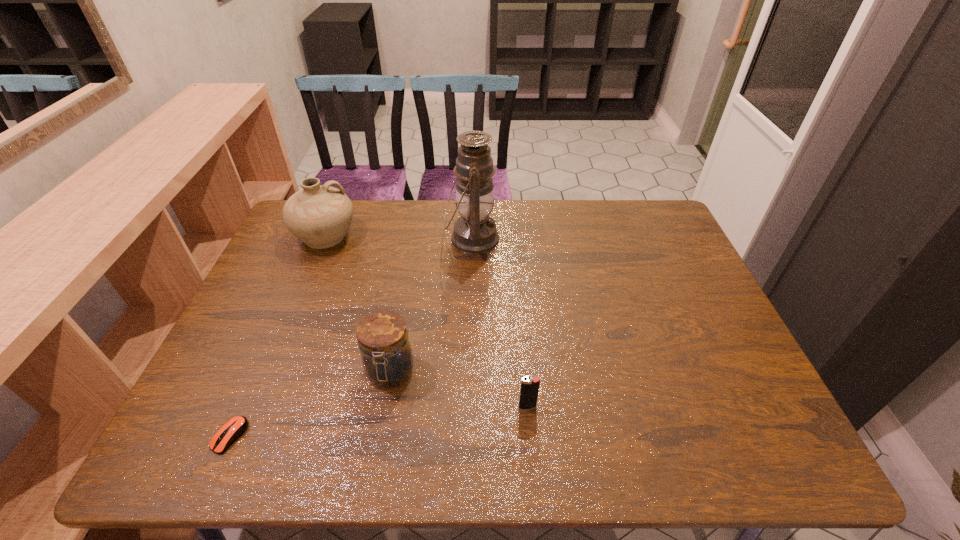
At what (x,y) coordinates should I click in order to perform the action: click on object that is at the near left corner. Please return your answer as a coordinate pair (x, y). This screenshot has height=540, width=960. Looking at the image, I should click on click(x=235, y=427).

What are the coordinates of `free location at the far edge of the desktop` in the screenshot? It's located at (370, 214).

Locate an element on the screen. The height and width of the screenshot is (540, 960). vacant area at the near edge of the desktop is located at coordinates (608, 430).

Find the location of a particular element. This screenshot has width=960, height=540. vacant area at the left edge of the desktop is located at coordinates coord(261,401).

The width and height of the screenshot is (960, 540). In the image, there is a desktop. Identify the location of blank space at the right edge. (644, 259).

Where is `vacant space that is in between the igniter and the jar`? The width and height of the screenshot is (960, 540). vacant space that is in between the igniter and the jar is located at coordinates (459, 389).

Locate an element on the screen. The height and width of the screenshot is (540, 960). free point between the tallest object and the igniter is located at coordinates (500, 323).

Where is `vacant region between the third nearest object and the igniter`? The image size is (960, 540). vacant region between the third nearest object and the igniter is located at coordinates (459, 389).

Locate an element on the screen. vacant area that lies between the third object from left to right and the fourth tallest object is located at coordinates (459, 389).

Locate an element on the screen. empty space between the shortest object and the rightmost object is located at coordinates (378, 421).